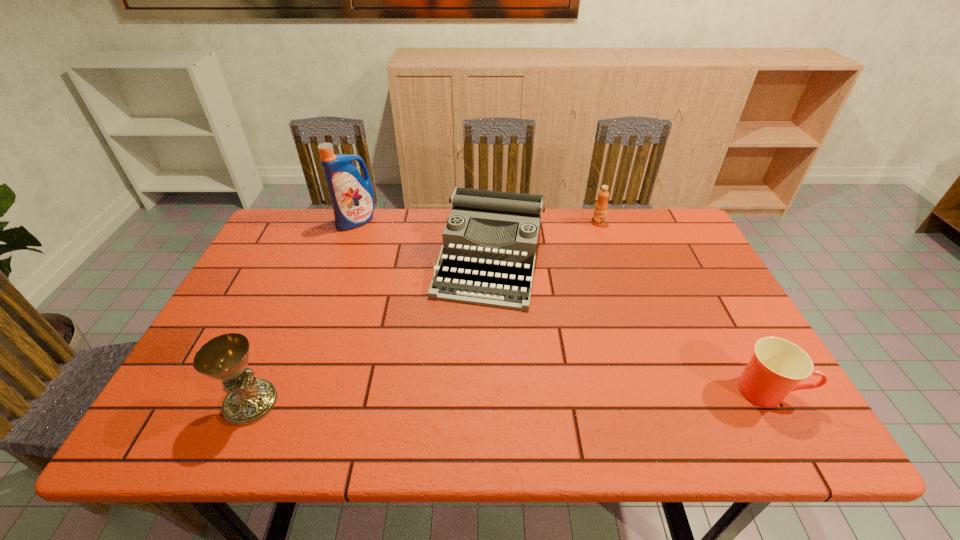
Image resolution: width=960 pixels, height=540 pixels. Find the location of `chalice`. chalice is located at coordinates (225, 357).

Identify the location of the rightmost object. This screenshot has height=540, width=960. (777, 365).

Image resolution: width=960 pixels, height=540 pixels. I want to click on typewriter, so click(490, 240).

The height and width of the screenshot is (540, 960). In order to click on detergent in this screenshot , I will do [x=352, y=197].

Identify the location of the second object from right to left. The width and height of the screenshot is (960, 540). (601, 206).

Locate an element on the screen. vacant area situated 0.260m on the right of the chalice is located at coordinates (398, 402).

Identify the location of vacant region located 0.350m on the back of the rightmost object. This screenshot has height=540, width=960. (700, 269).

Image resolution: width=960 pixels, height=540 pixels. Find the location of `vacant space located on the typing side of the third object from left to right`. vacant space located on the typing side of the third object from left to right is located at coordinates click(x=472, y=340).

Find the location of a particular element. This screenshot has width=960, height=540. free space located 0.270m on the typing side of the third object from left to right is located at coordinates (457, 400).

The image size is (960, 540). In order to click on blank area located 0.230m on the typing side of the third object from left to right in this screenshot , I will do `click(461, 384)`.